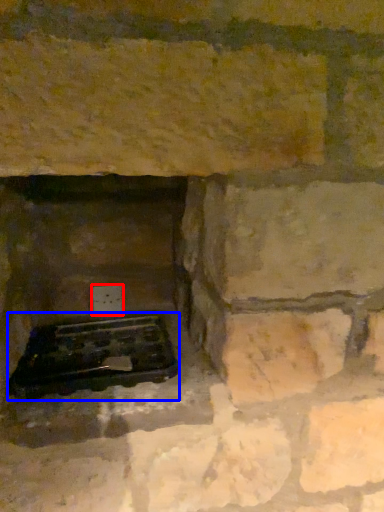
Question: Which point is closer to the camera, electric outlet (highlighted by a red box) or grill (highlighted by a blue box)?

Choices:
 (A) electric outlet
 (B) grill

Answer: (B)